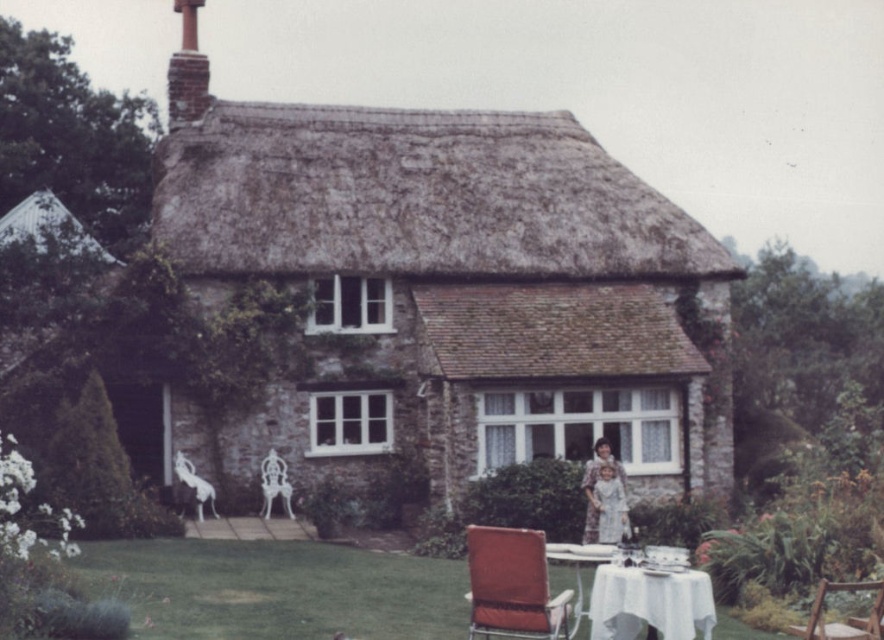
Question: Does wooden chair at center lie behind white cloth-covered table at lower center?

Choices:
 (A) no
 (B) yes

Answer: (A)

Question: Is the position of white cloth-covered table at lower right more distant than that of white cloth-covered table at lower center?

Choices:
 (A) no
 (B) yes

Answer: (B)

Question: Among these objects, which one is farthest from the camera?

Choices:
 (A) green grass at lower center
 (B) matte orange chair at lower center
 (C) white cloth-covered table at lower right
 (D) floral fabric dress at center

Answer: (D)

Question: Is white cloth-covered table at lower center thinner than floral fabric dress at center?

Choices:
 (A) yes
 (B) no

Answer: (B)

Question: Based on their relative distances, which object is nearer to the white cloth-covered table at lower center?

Choices:
 (A) wooden chair at center
 (B) white cloth-covered table at lower right

Answer: (B)

Question: Which is farther from the floral fabric dress at center?

Choices:
 (A) green grass at lower center
 (B) wooden chair at center

Answer: (B)